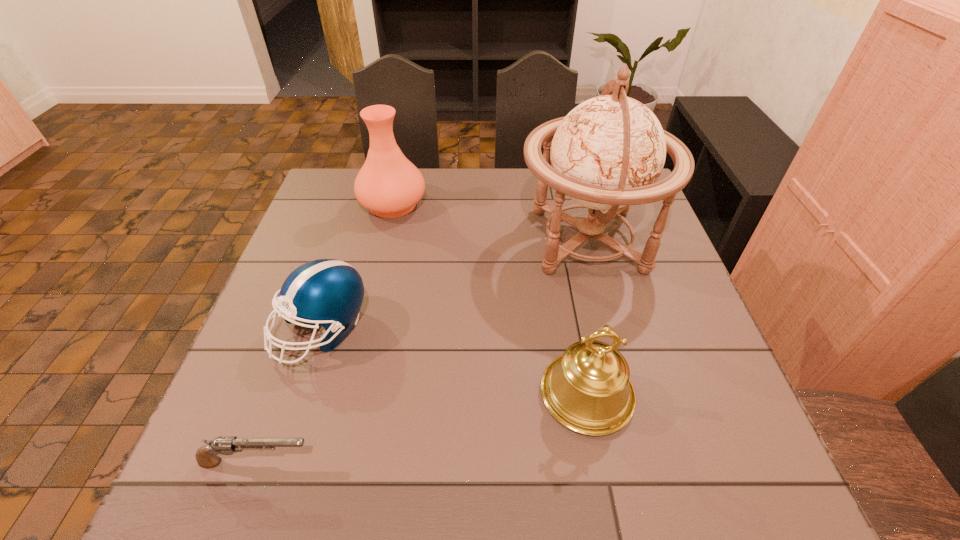
Identify which object is located as the nearest to the tallest object. Please provide its 2D coordinates. Your answer should be formatted as a tuple, i.e. [(x, y)], where the tuple contains the x and y coordinates of a point satisfying the conditions above.

[(587, 389)]

Find the location of a particular element. The width and height of the screenshot is (960, 540). vacant position in the image that satisfies the following two spatial constraints: 1. at the front of the globe showing Africa; 2. at the front of the second shortest object with the faceguard is located at coordinates (612, 329).

Where is `vacant area in the image that satisfies the following two spatial constraints: 1. at the front of the globe showing Africa; 2. at the front of the football helmet with the faceguard`? The height and width of the screenshot is (540, 960). vacant area in the image that satisfies the following two spatial constraints: 1. at the front of the globe showing Africa; 2. at the front of the football helmet with the faceguard is located at coordinates (612, 329).

You are a GUI agent. You are given a task and a screenshot of the screen. Output one action in this format:
    pyautogui.click(x=<x>, y=<y>)
    Task: Click on the free space that satisfies the following two spatial constraints: 1. at the front of the globe showing Africa; 2. at the front of the football helmet with the faceguard
    
    Given the screenshot: What is the action you would take?
    pyautogui.click(x=612, y=329)

Image resolution: width=960 pixels, height=540 pixels. Find the location of `blank space that satisfies the following two spatial constraints: 1. at the front of the globe showing Africa; 2. at the front of the second shortest object with the faceguard`. blank space that satisfies the following two spatial constraints: 1. at the front of the globe showing Africa; 2. at the front of the second shortest object with the faceguard is located at coordinates (612, 329).

You are a GUI agent. You are given a task and a screenshot of the screen. Output one action in this format:
    pyautogui.click(x=<x>, y=<y>)
    Task: Click on the free space in the image that satisfies the following two spatial constraints: 1. at the front of the bell with the faceguard; 2. on the left side of the football helmet
    The image size is (960, 540).
    Given the screenshot: What is the action you would take?
    pyautogui.click(x=301, y=394)

The width and height of the screenshot is (960, 540). Identify the location of vacant space that satisfies the following two spatial constraints: 1. at the front of the bell with the faceguard; 2. on the right side of the second shortest object. (301, 394).

The image size is (960, 540). Identify the location of vacant space that satisfies the following two spatial constraints: 1. at the front of the second shortest object with the faceguard; 2. aiming along the barrel of the nearest object. (280, 462).